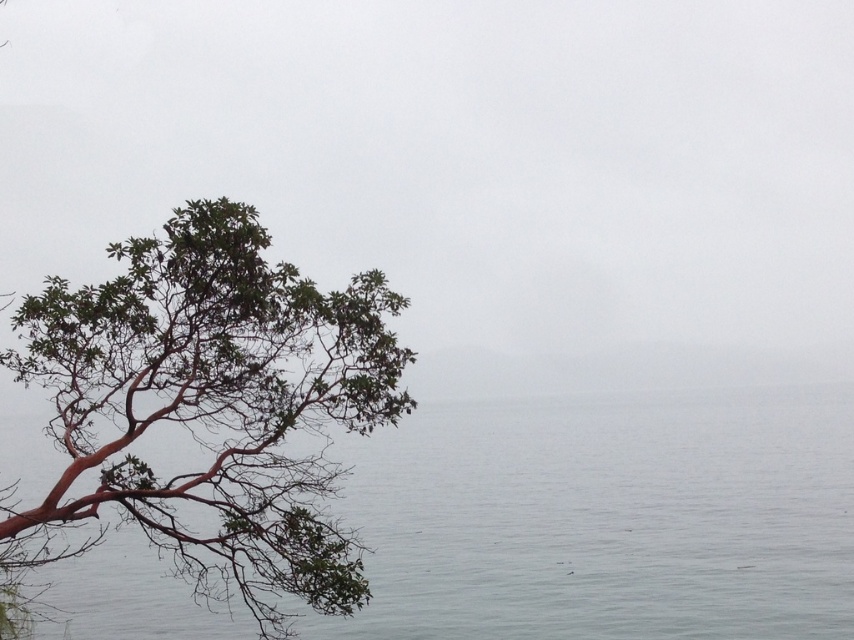
Question: Is clear water at left to the right of smooth reddish-brown tree branch at left from the viewer's perspective?

Choices:
 (A) yes
 (B) no

Answer: (A)

Question: Can you confirm if clear water at left is positioned below smooth reddish-brown tree branch at left?

Choices:
 (A) yes
 (B) no

Answer: (A)

Question: Which point is closer to the camera?

Choices:
 (A) smooth reddish-brown tree branch at left
 (B) clear water at left

Answer: (A)

Question: Which point is closer to the camera?

Choices:
 (A) smooth reddish-brown tree branch at left
 (B) clear water at left

Answer: (A)

Question: Does clear water at left lie in front of smooth reddish-brown tree branch at left?

Choices:
 (A) yes
 (B) no

Answer: (B)